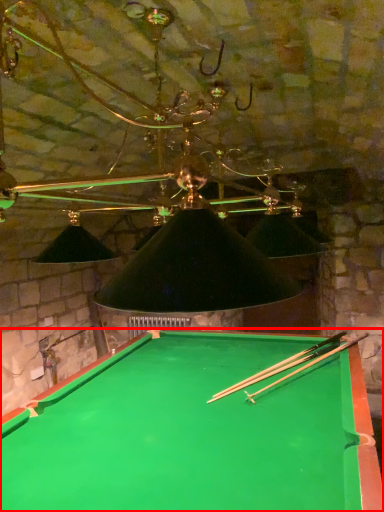
Question: Where is billiard table (annotated by the red box) located in relation to cue in the image?

Choices:
 (A) left
 (B) right

Answer: (A)